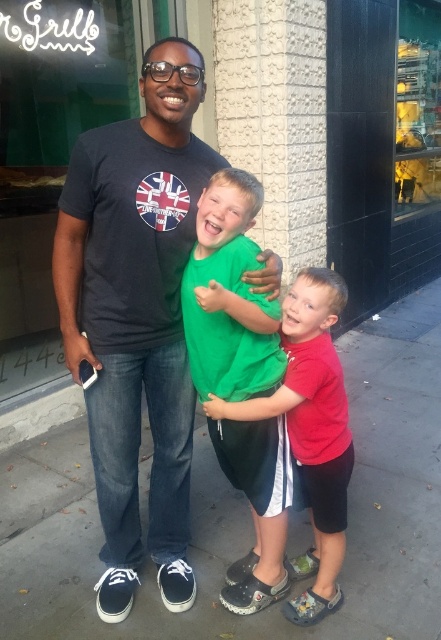
You are standing at point (332,451) and want to move to point (396,570). Is the path directly behind you?

Yes, the path directly behind you leads to point (396,570) because point (396,570) is located behind point (332,451) according to the spatial description.

You are a delivery person trying to place a package on the gray concrete sidewalk at center while avoiding stepping on the red matte shirt at center. Is the sidewalk accessible without stepping on the shirt?

The gray concrete sidewalk at center is further to the viewer than the red matte shirt at center, so you can reach the sidewalk without stepping on the shirt.